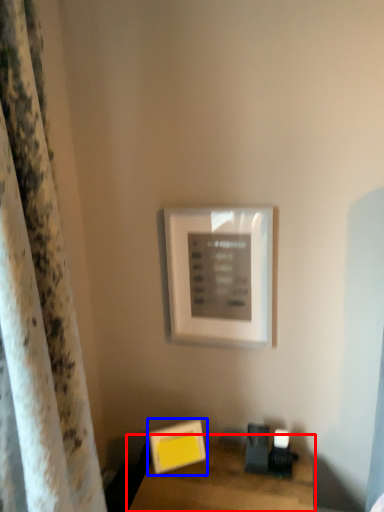
Question: Among these objects, which one is nearest to the camera, table (highlighted by a red box) or picture frame (highlighted by a blue box)?

Choices:
 (A) table
 (B) picture frame

Answer: (A)